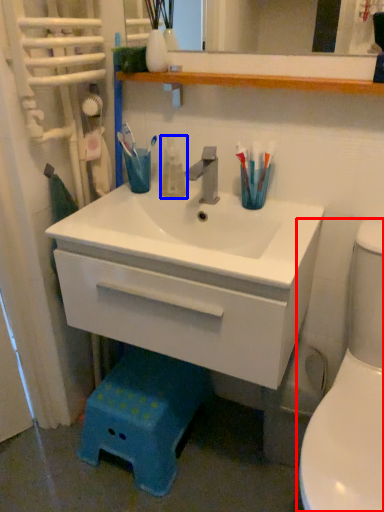
Question: Which point is closer to the camera, toilet (highlighted by a red box) or mouthwash (highlighted by a blue box)?

Choices:
 (A) toilet
 (B) mouthwash

Answer: (A)